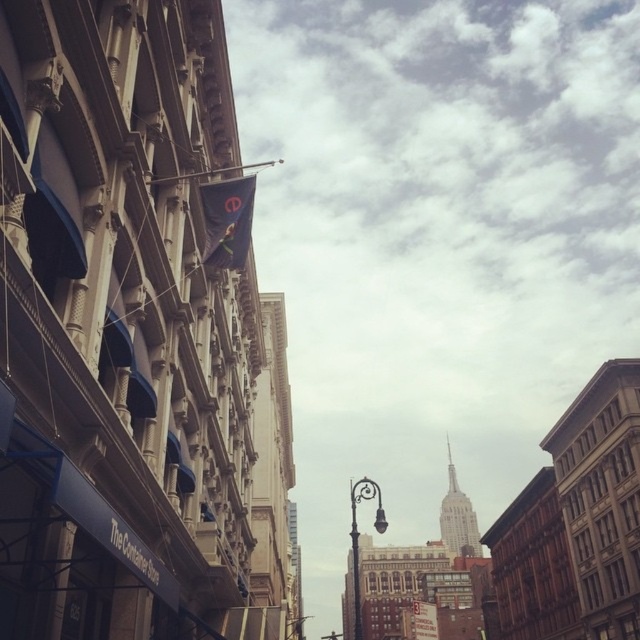
Question: Where is black metal streetlight at center located in relation to metallic flagpole at upper center in the image?

Choices:
 (A) right
 (B) left

Answer: (A)

Question: Among these objects, which one is farthest from the camera?

Choices:
 (A) metallic flagpole at upper center
 (B) dark blue fabric flag at upper center
 (C) black metal streetlight at center

Answer: (B)

Question: Which object is the closest to the metallic flagpole at upper center?

Choices:
 (A) black metal streetlight at center
 (B) dark blue fabric flag at upper center

Answer: (B)

Question: Does black metal streetlight at center come in front of metallic flagpole at upper center?

Choices:
 (A) no
 (B) yes

Answer: (A)

Question: Among these objects, which one is nearest to the camera?

Choices:
 (A) dark blue fabric flag at upper center
 (B) black metal streetlight at center

Answer: (B)

Question: Can you confirm if dark blue fabric flag at upper center is wider than black metal streetlight at center?

Choices:
 (A) yes
 (B) no

Answer: (B)